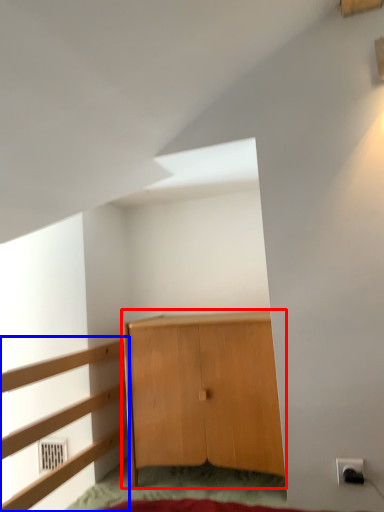
Question: Which of the following is the farthest to the observer, cupboard (highlighted by a red box) or dresser (highlighted by a blue box)?

Choices:
 (A) cupboard
 (B) dresser

Answer: (A)